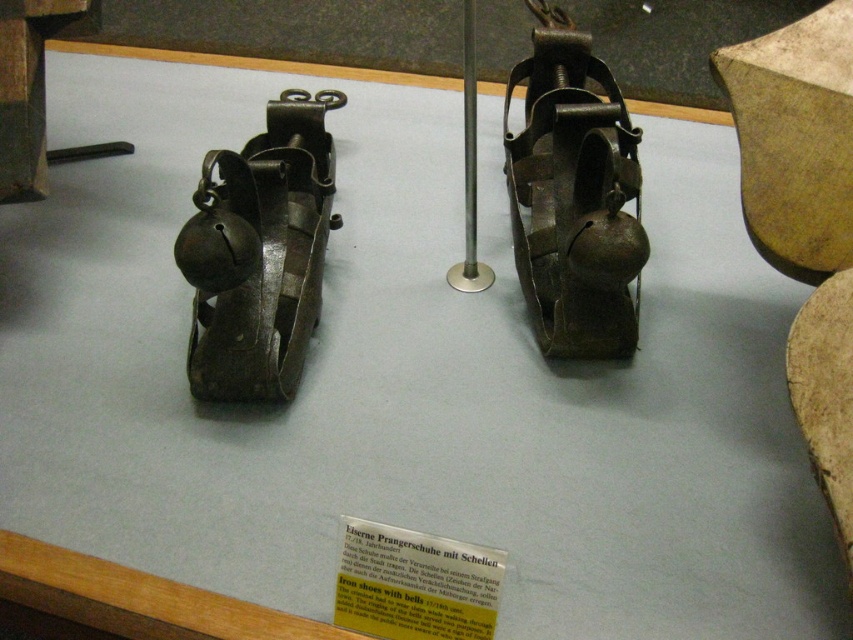
You are a museum visitor looking at the exhibit. You see the matte metal iron shoe with bells at center and the dark brown leather shoe at center. Which shoe is located to the right of the other?

The matte metal iron shoe with bells at center is positioned on the right side of the dark brown leather shoe at center.

You are a museum visitor observing the two shoes displayed on the light blue surface. Which of the two shoes, the matte metal iron shoe with bells at center or the dark brown leather shoe at center, is larger in size?

The matte metal iron shoe with bells at center is bigger than the dark brown leather shoe at center.

From the picture: You are a museum visitor looking at the exhibit. You notice the matte metal iron shoe with bells at center and the dark brown leather shoe at center. Which one is positioned higher in the display?

The matte metal iron shoe with bells at center is positioned higher than the dark brown leather shoe at center in the display.